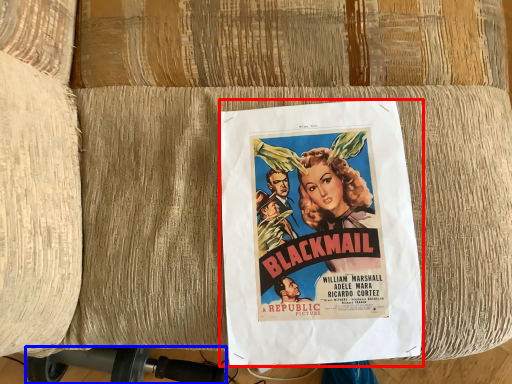
Question: Among these objects, which one is farthest to the camera, poster (highlighted by a red box) or vacuum (highlighted by a blue box)?

Choices:
 (A) poster
 (B) vacuum

Answer: (B)